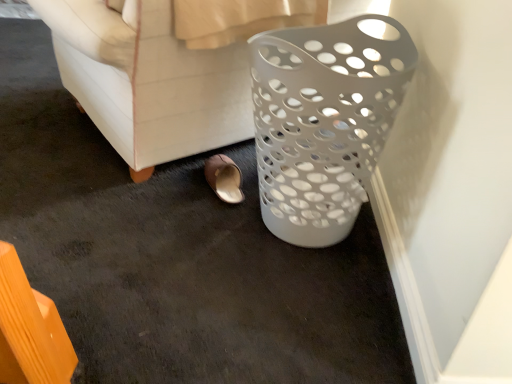
Question: In terms of height, does white plastic basket at right look taller or shorter compared to white plastic laundry basket at right?

Choices:
 (A) tall
 (B) short

Answer: (B)

Question: From the image's perspective, is white plastic basket at right located above or below white plastic laundry basket at right?

Choices:
 (A) below
 (B) above

Answer: (A)

Question: Estimate the real-world distances between objects in this image. Which object is closer to the white plastic laundry basket at right?

Choices:
 (A) brown leather slipper at lower center
 (B) white plastic basket at right

Answer: (B)

Question: Based on their relative distances, which object is farther from the white plastic basket at right?

Choices:
 (A) white plastic laundry basket at right
 (B) brown leather slipper at lower center

Answer: (B)